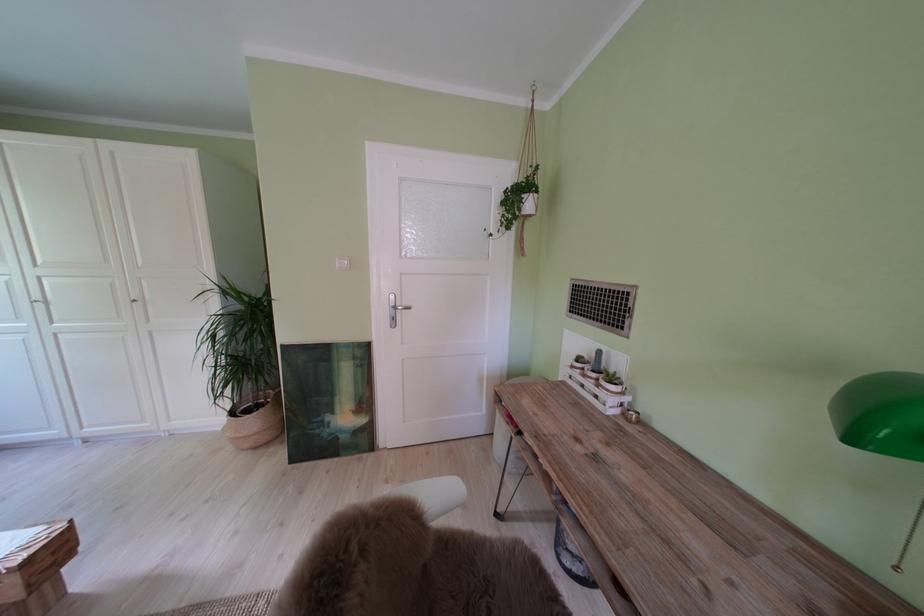
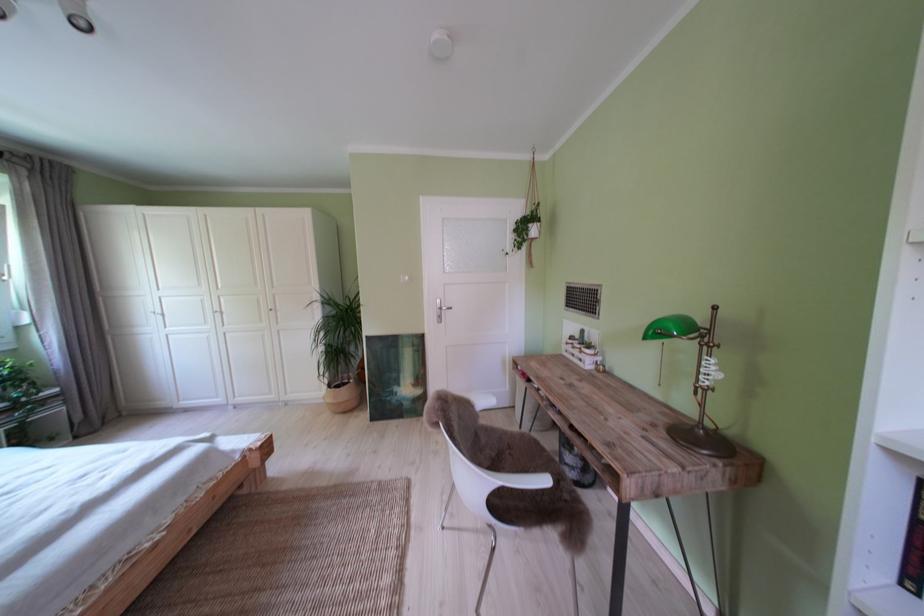
Locate, in the second image, the point that corresponds to point 505,219 in the first image.

(520, 244)